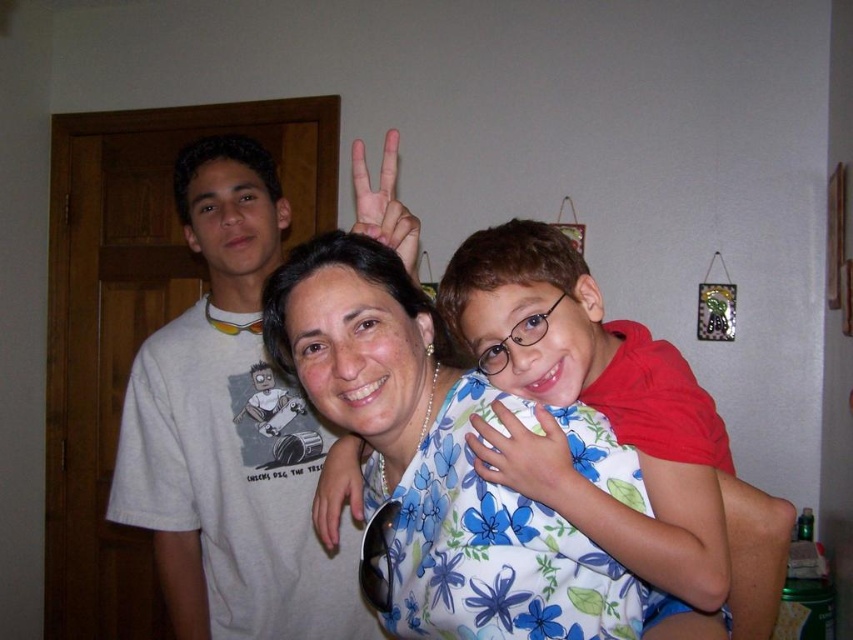
Question: Considering the real-world distances, which object is closest to the floral fabric hand at center?

Choices:
 (A) white t-shirt at left
 (B) floral fabric shirt at center
 (C) matte skin hand at center

Answer: (B)

Question: Which of the following is the closest to the observer?

Choices:
 (A) white t-shirt at left
 (B) matte skin hand at center
 (C) matte black sunglasses at center
 (D) floral fabric hand at center

Answer: (D)

Question: Can you confirm if matte skin hand at center is smaller than matte black sunglasses at center?

Choices:
 (A) yes
 (B) no

Answer: (B)

Question: Does white t-shirt at left have a lesser width compared to floral fabric hand at center?

Choices:
 (A) yes
 (B) no

Answer: (B)

Question: Where is white t-shirt at left located in relation to matte black sunglasses at center in the image?

Choices:
 (A) below
 (B) above

Answer: (B)

Question: Which object is farther from the camera taking this photo?

Choices:
 (A) white t-shirt at left
 (B) floral fabric hand at center

Answer: (A)